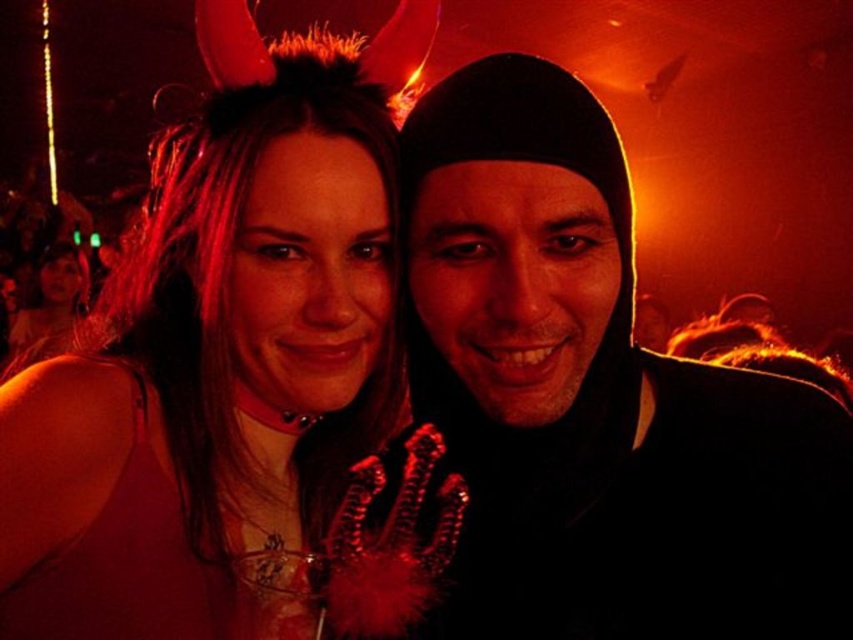
Question: Is black matte beanie at center below matte black hair at center?

Choices:
 (A) yes
 (B) no

Answer: (A)

Question: Which object appears closest to the camera in this image?

Choices:
 (A) matte black hair at center
 (B) black matte beanie at center

Answer: (B)

Question: Considering the relative positions of black matte beanie at center and matte black hair at center in the image provided, where is black matte beanie at center located with respect to matte black hair at center?

Choices:
 (A) left
 (B) right

Answer: (B)

Question: Is the position of black matte beanie at center more distant than that of matte black hair at center?

Choices:
 (A) yes
 (B) no

Answer: (B)

Question: Among these objects, which one is farthest from the camera?

Choices:
 (A) matte black hair at center
 (B) black matte beanie at center

Answer: (A)